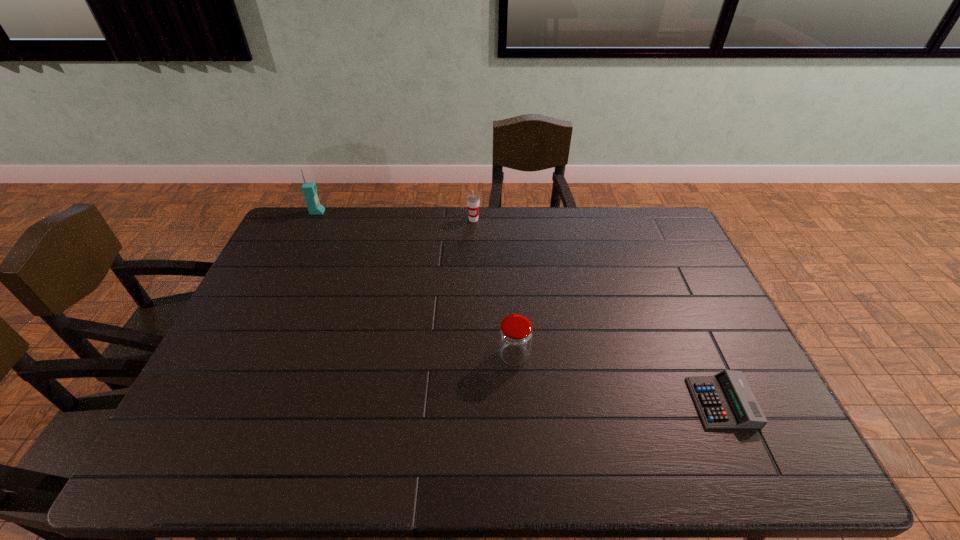
Locate an element on the screen. The width and height of the screenshot is (960, 540). the tallest object is located at coordinates (309, 189).

Locate an element on the screen. The image size is (960, 540). cellular telephone is located at coordinates (309, 189).

I want to click on cup, so click(473, 200).

This screenshot has height=540, width=960. Identify the location of the third nearest object. (473, 200).

Image resolution: width=960 pixels, height=540 pixels. In order to click on the second nearest object in this screenshot , I will do `click(515, 335)`.

The image size is (960, 540). I want to click on the third object from left to right, so click(x=515, y=335).

I want to click on the nearest object, so click(x=725, y=400).

Locate an element on the screen. the rightmost object is located at coordinates (725, 400).

Locate an element on the screen. blank space located on the keypad of the cellular telephone is located at coordinates (353, 212).

The width and height of the screenshot is (960, 540). I want to click on vacant space situated 0.290m on the side of the second farthest object with the logo, so click(x=472, y=276).